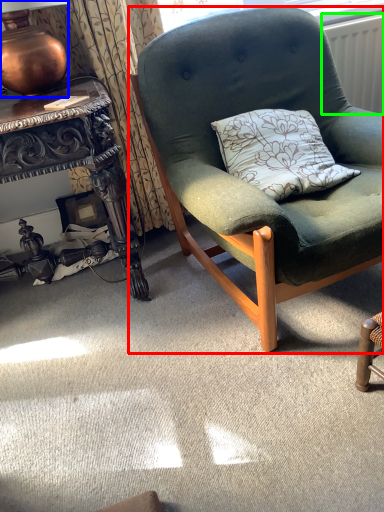
Question: Which is nearer to the chair (highlighted by a red box)? lamp (highlighted by a blue box) or radiator (highlighted by a green box).

Choices:
 (A) lamp
 (B) radiator

Answer: (A)